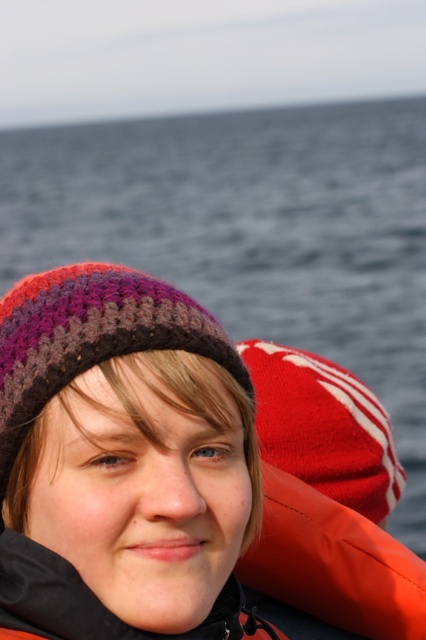
You are a photographer trying to capture the knitted woolen hat at center in your shot. Given that the camera frame is a rectangle with coordinates from 0 to 1 on both axes, can you confirm if the point at coordinates (161, 481) lies within the frame?

The point at coordinates (161, 481) is within the camera frame since the frame spans from 0 to 1 on both axes, so yes, the knitted woolen hat at center is within the frame.

You are a photographer trying to capture the person in the scene. You need to focus on both the knitted woolen hat at left and the orange synthetic life jacket at right. Which object should you adjust your camera focus to first if you want to ensure both are in clear view?

The knitted woolen hat at left is positioned on the left side of orange synthetic life jacket at right. To ensure both are in clear view, focus on the orange synthetic life jacket at right first since it is closer to the camera, and the hat will naturally come into focus as part of the same focal plane.

You are a photographer trying to capture the person in the image. Since the knitted woolen hat at left and the orange synthetic life jacket at right are both visible, which one appears taller in the photo?

The knitted woolen hat at left appears taller than the orange synthetic life jacket at right in the photo.